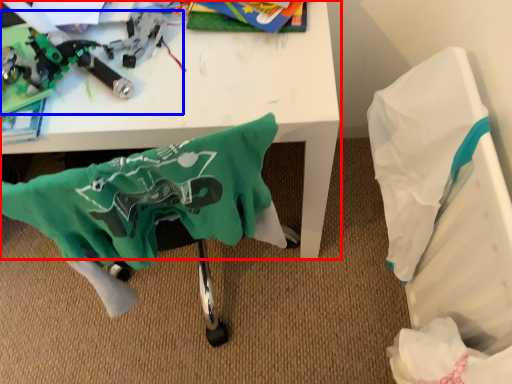
Question: Among these objects, which one is nearest to the camera, table (highlighted by a red box) or toy (highlighted by a blue box)?

Choices:
 (A) table
 (B) toy

Answer: (A)